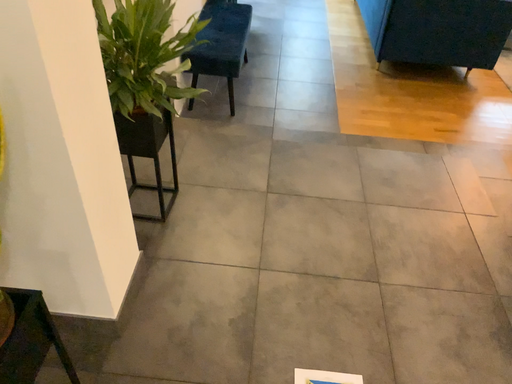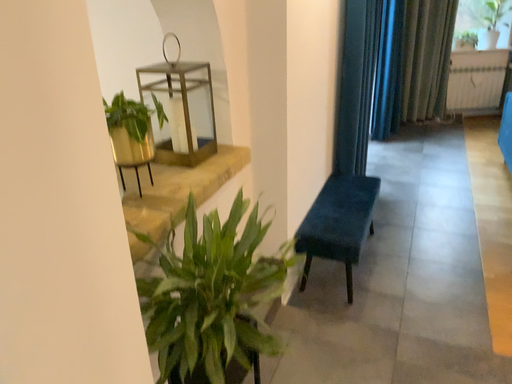
Question: Which way did the camera rotate in the video?

Choices:
 (A) rotated upward
 (B) rotated downward

Answer: (A)